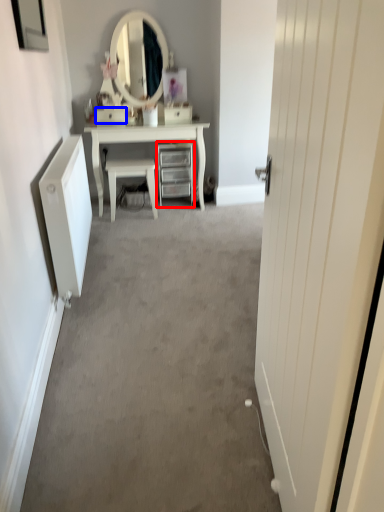
Question: Which point is further to the camera, chest of drawers (highlighted by a red box) or drawer (highlighted by a blue box)?

Choices:
 (A) chest of drawers
 (B) drawer

Answer: (A)